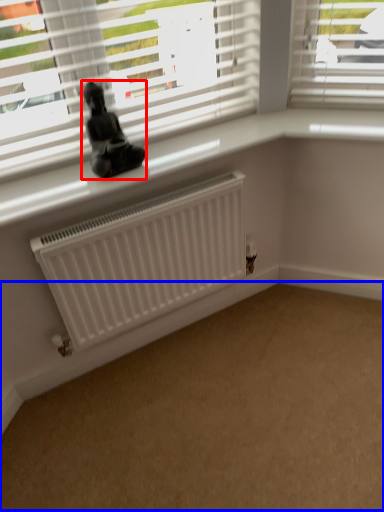
Question: Which object appears closest to the camera in this image, miniature (highlighted by a red box) or plain (highlighted by a blue box)?

Choices:
 (A) miniature
 (B) plain

Answer: (B)